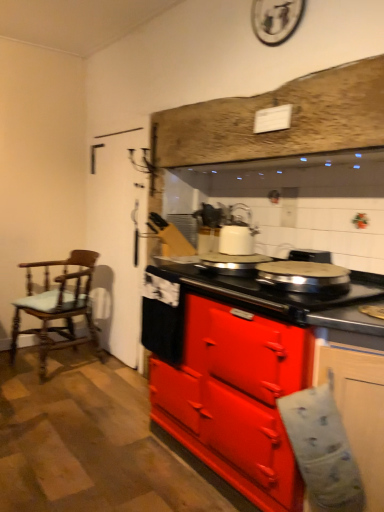
Question: From their relative heights in the image, would you say matte red stove at center, acting as the first cabinetry starting from the back, is taller or shorter than white glossy kettle at center?

Choices:
 (A) tall
 (B) short

Answer: (A)

Question: Is matte red stove at center, acting as the first cabinetry starting from the back, inside the boundaries of white glossy kettle at center, or outside?

Choices:
 (A) outside
 (B) inside

Answer: (A)

Question: Estimate the real-world distances between objects in this image. Which object is closer to the wooden chair with cushion at left?

Choices:
 (A) matte red stove at center, acting as the first cabinetry starting from the back
 (B) matte white cabinet at lower right, placed as the second cabinetry when sorted from back to front
 (C) white glossy kettle at center

Answer: (C)

Question: Estimate the real-world distances between objects in this image. Which object is farther from the matte white cabinet at lower right, placed as the second cabinetry when sorted from back to front?

Choices:
 (A) wooden chair with cushion at left
 (B) white glossy kettle at center
 (C) matte red stove at center, positioned as the 2th cabinetry in front-to-back order

Answer: (A)